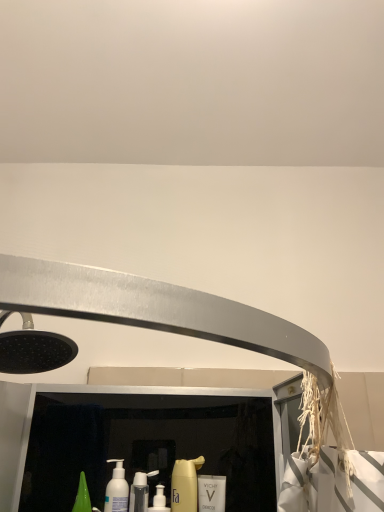
Question: Does white glossy mouthwash at center, which is the second mouthwash in left-to-right order, have a smaller size compared to white glossy bottle at center, positioned as the second cleaning product in right-to-left order?

Choices:
 (A) no
 (B) yes

Answer: (B)

Question: Is white glossy bottle at center, which is counted as the 1th cleaning product, starting from the left, inside white glossy mouthwash at center, which ranks as the 1th mouthwash in right-to-left order?

Choices:
 (A) no
 (B) yes

Answer: (A)

Question: From a real-world perspective, is white glossy mouthwash at center, which is the second mouthwash in left-to-right order, under white glossy bottle at center, positioned as the second cleaning product in right-to-left order?

Choices:
 (A) no
 (B) yes

Answer: (A)

Question: Does white glossy mouthwash at center, which is the second mouthwash in left-to-right order, appear on the left side of white glossy bottle at center, which is counted as the 1th cleaning product, starting from the left?

Choices:
 (A) yes
 (B) no

Answer: (B)

Question: Is white glossy mouthwash at center, which is the second mouthwash in left-to-right order, wider than white glossy bottle at center, which is counted as the 1th cleaning product, starting from the left?

Choices:
 (A) yes
 (B) no

Answer: (B)

Question: Is white glossy mouthwash at center, which is the second mouthwash in left-to-right order, inside the boundaries of white glossy bottle at center, which is counted as the 1th cleaning product, starting from the left, or outside?

Choices:
 (A) outside
 (B) inside

Answer: (A)

Question: Does point (218, 488) appear closer or farther from the camera than point (140, 477)?

Choices:
 (A) farther
 (B) closer

Answer: (B)

Question: From a real-world perspective, is white glossy mouthwash at center, which ranks as the 1th mouthwash in right-to-left order, positioned above or below white glossy bottle at center, positioned as the second cleaning product in right-to-left order?

Choices:
 (A) above
 (B) below

Answer: (A)

Question: Considering the positions of white glossy mouthwash at center, which is the second mouthwash in left-to-right order, and white glossy bottle at center, which is counted as the 1th cleaning product, starting from the left, in the image, is white glossy mouthwash at center, which is the second mouthwash in left-to-right order, bigger or smaller than white glossy bottle at center, which is counted as the 1th cleaning product, starting from the left,?

Choices:
 (A) small
 (B) big

Answer: (A)

Question: From a real-world perspective, is yellow matte bottle at center, which ranks as the second cleaning product in left-to-right order, above or below white matte bottle at lower left, positioned as the second mouthwash in right-to-left order?

Choices:
 (A) above
 (B) below

Answer: (A)

Question: Considering the positions of point (173, 507) and point (117, 472), is point (173, 507) closer or farther from the camera than point (117, 472)?

Choices:
 (A) closer
 (B) farther

Answer: (A)

Question: Considering the positions of yellow matte bottle at center, which ranks as the first cleaning product in right-to-left order, and white matte bottle at lower left, the 1th mouthwash from the left, in the image, is yellow matte bottle at center, which ranks as the first cleaning product in right-to-left order, wider or thinner than white matte bottle at lower left, the 1th mouthwash from the left,?

Choices:
 (A) thin
 (B) wide

Answer: (A)

Question: Is yellow matte bottle at center, which ranks as the first cleaning product in right-to-left order, taller or shorter than white matte bottle at lower left, positioned as the second mouthwash in right-to-left order?

Choices:
 (A) short
 (B) tall

Answer: (B)

Question: From a real-world perspective, relative to white matte bottle at lower left, the 1th mouthwash from the left, is white glossy mouthwash at center, which ranks as the 1th mouthwash in right-to-left order, vertically above or below?

Choices:
 (A) below
 (B) above

Answer: (A)

Question: Would you say white glossy mouthwash at center, which ranks as the 1th mouthwash in right-to-left order, is to the left or to the right of white matte bottle at lower left, positioned as the second mouthwash in right-to-left order, in the picture?

Choices:
 (A) right
 (B) left

Answer: (A)